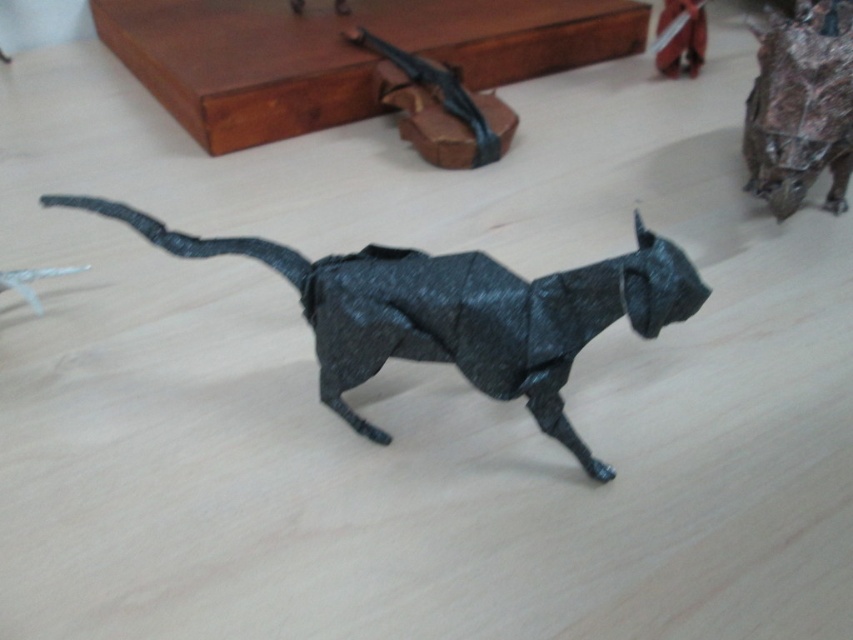
Question: In this image, where is matte black origami cat at upper center located relative to metallic silver sword at upper right?

Choices:
 (A) below
 (B) above

Answer: (A)

Question: Which point is farther to the camera?

Choices:
 (A) (460, 115)
 (B) (604, 292)
 (C) (657, 33)

Answer: (C)

Question: In this image, where is black paper cat at center located relative to metallic silver sword at upper right?

Choices:
 (A) right
 (B) left

Answer: (B)

Question: Is rustic brown paper bag at upper right smaller than matte black origami cat at upper center?

Choices:
 (A) yes
 (B) no

Answer: (A)

Question: Estimate the real-world distances between objects in this image. Which object is farther from the metallic silver sword at upper right?

Choices:
 (A) matte black origami cat at upper center
 (B) rustic brown paper bag at upper right

Answer: (A)

Question: Which point is farther to the camera?

Choices:
 (A) matte black origami cat at upper center
 (B) metallic silver sword at upper right
 (C) black paper cat at center
 (D) rustic brown paper bag at upper right

Answer: (B)